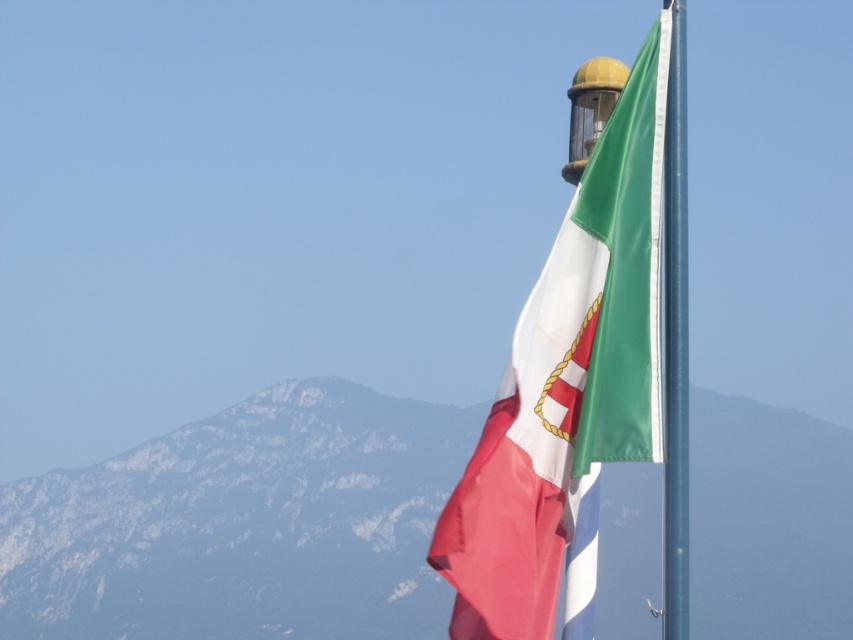
Question: Is rocky mountain at center thinner than metallic flag pole at right?

Choices:
 (A) no
 (B) yes

Answer: (A)

Question: Is matte fabric flag at upper right positioned behind metallic flag pole at right?

Choices:
 (A) yes
 (B) no

Answer: (B)

Question: Among these points, which one is farthest from the camera?

Choices:
 (A) (677, 468)
 (B) (442, 524)
 (C) (49, 522)

Answer: (C)

Question: Is rocky mountain at center bigger than metallic flag pole at right?

Choices:
 (A) no
 (B) yes

Answer: (B)

Question: Which is farther from the metallic flag pole at right?

Choices:
 (A) matte fabric flag at upper right
 (B) rocky mountain at center

Answer: (B)

Question: Which object is positioned closest to the rocky mountain at center?

Choices:
 (A) matte fabric flag at upper right
 (B) metallic flag pole at right

Answer: (B)